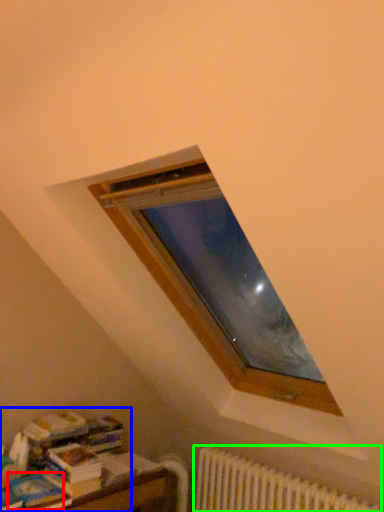
Question: Considering the real-world distances, which object is farthest from paperback book (highlighted by a red box)? book (highlighted by a blue box) or radiator (highlighted by a green box)?

Choices:
 (A) book
 (B) radiator

Answer: (B)